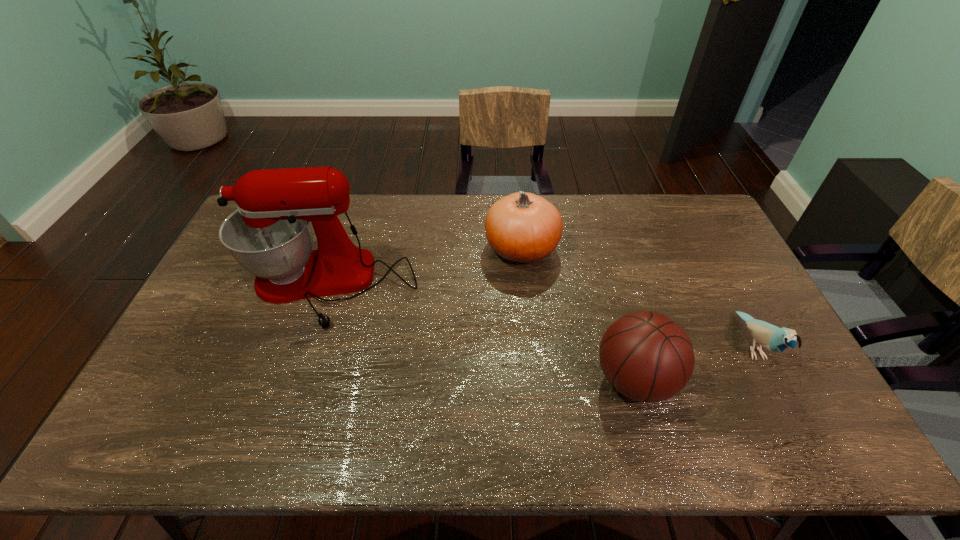
Where is `object that is at the far edge`? Image resolution: width=960 pixels, height=540 pixels. object that is at the far edge is located at coordinates 522,227.

At what (x,y) coordinates should I click in order to perform the action: click on object located at the left edge. Please return your answer as a coordinate pair (x, y). Looking at the image, I should click on (269, 235).

Find the location of a particular element. This screenshot has height=540, width=960. object that is positioned at the right edge is located at coordinates (773, 338).

Locate an element on the screen. free space at the far edge of the desktop is located at coordinates (397, 233).

The height and width of the screenshot is (540, 960). I want to click on vacant position at the near edge of the desktop, so coord(668,434).

The image size is (960, 540). I want to click on free space at the left edge of the desktop, so click(221, 294).

Where is `free spot at the right edge of the desktop`? This screenshot has width=960, height=540. free spot at the right edge of the desktop is located at coordinates (732, 304).

The image size is (960, 540). In the image, there is a desktop. Find the location of `free space at the near left corner`. free space at the near left corner is located at coordinates (178, 444).

Identify the location of vacant region at the far right corner. [x=697, y=232].

Locate an element on the screen. The image size is (960, 540). free spot between the basketball and the tallest object is located at coordinates (481, 334).